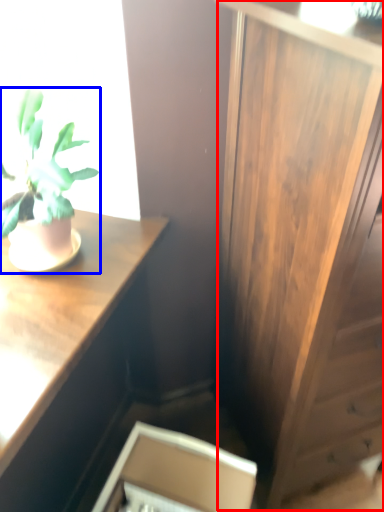
Question: Among these objects, which one is nearest to the camera, side cabinet (highlighted by a red box) or houseplant (highlighted by a blue box)?

Choices:
 (A) side cabinet
 (B) houseplant

Answer: (A)